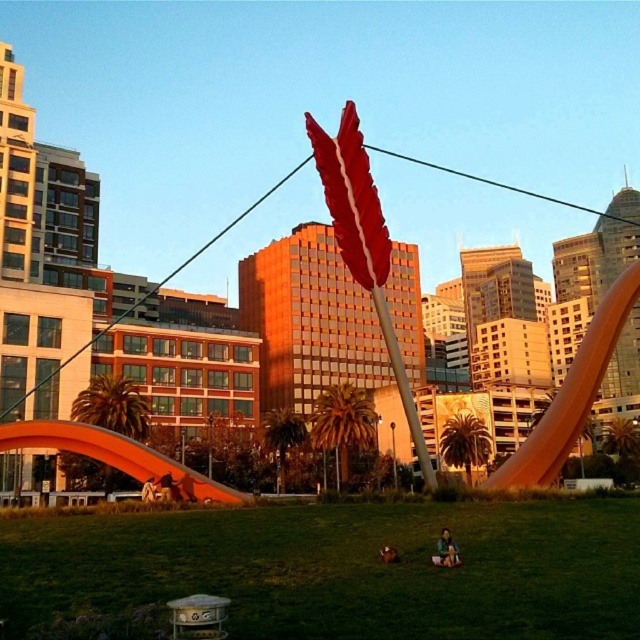
You are a photographer trying to capture both the green fabric person at lower center and the brown leather jacket at lower center in a single frame. Based on their sizes, which object should you focus on first to ensure both are in focus?

The green fabric person at lower center is much taller than the brown leather jacket at lower center, so you should focus on the green fabric person at lower center first to ensure both are in focus since it is larger and requires more attention in the frame.

You are a delivery robot with a package that needs to be placed between the green fabric person at lower center and the brown leather jacket at lower center. The package requires a minimum of 1.6 meters of space to be safely placed. Can you fit the package between them?

The green fabric person at lower center and brown leather jacket at lower center are 1.59 meters apart from each other, so the package requiring 1.6 meters of space cannot be safely placed between them as there is insufficient space.

You are a photographer wanting to capture both the green grass at center and the brown leather jacket at lower center in a single shot. Based on their positions, which object is closer to the camera?

The brown leather jacket at lower center is closer to the camera because it is positioned above the green grass at center, which is located below it.